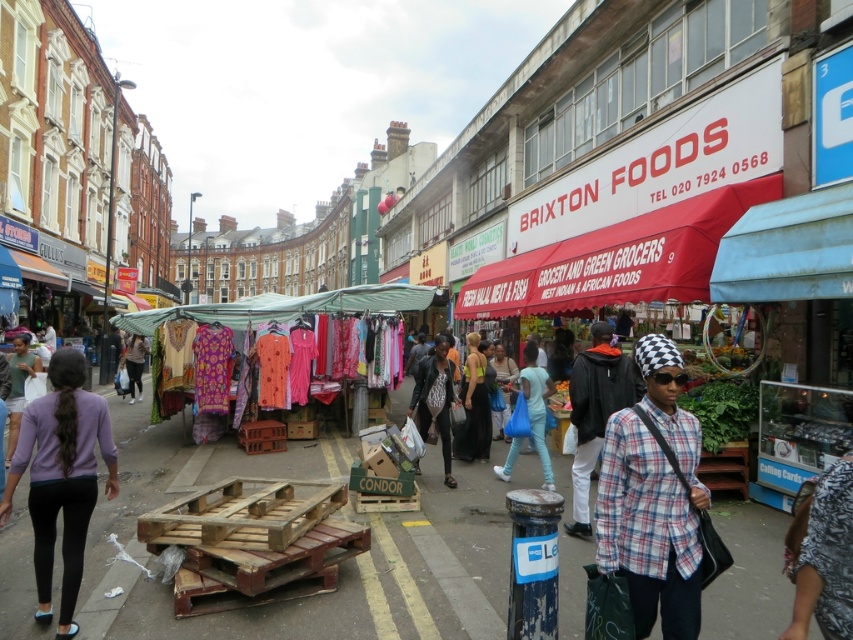
You are a photographer at the market and want to capture both the plaid shirt at center and the light purple shirt at lower left in the same frame. Which shirt should you focus on to ensure both are in the frame without moving the camera?

The plaid shirt at center is smaller in size than the light purple shirt at lower left, so focusing on the plaid shirt at center will allow both to be included in the frame since it takes up less space.

You are standing at the entrance of Brixton Foods and want to take a photo of two specific points in the scene. The first point is at coordinates point (x=579, y=394) and the second is at point (x=512, y=465). Which point will appear larger in your photo?

Point (x=579, y=394) is closer to the viewer than point (x=512, y=465), so it will appear larger in the photo.